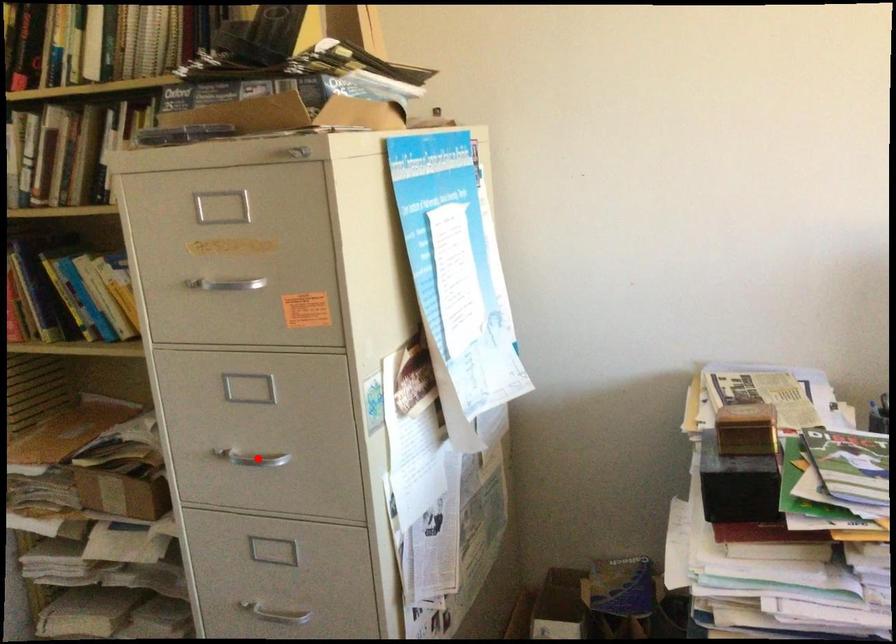
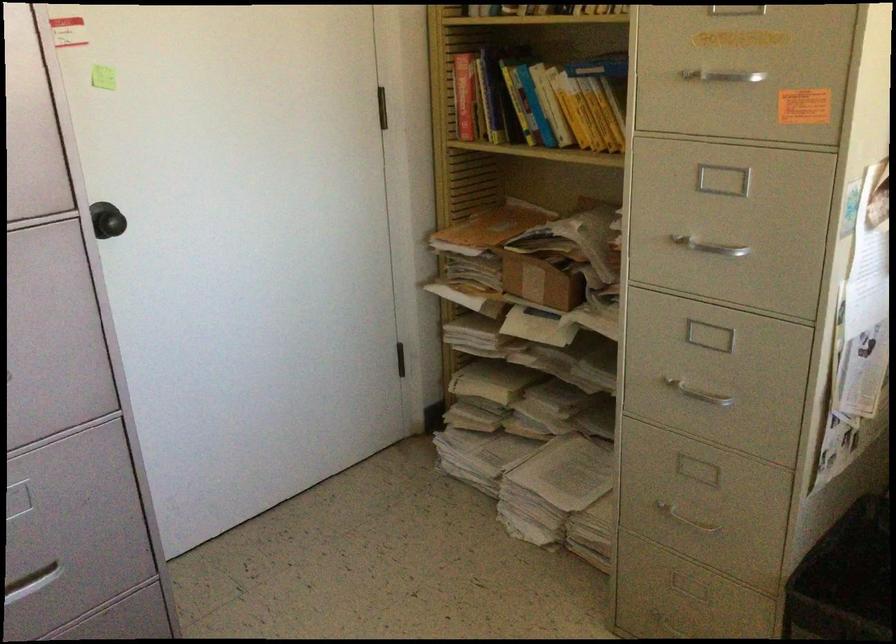
The point at the highlighted location is marked in the first image. Where is the corresponding point in the second image?

(710, 248)